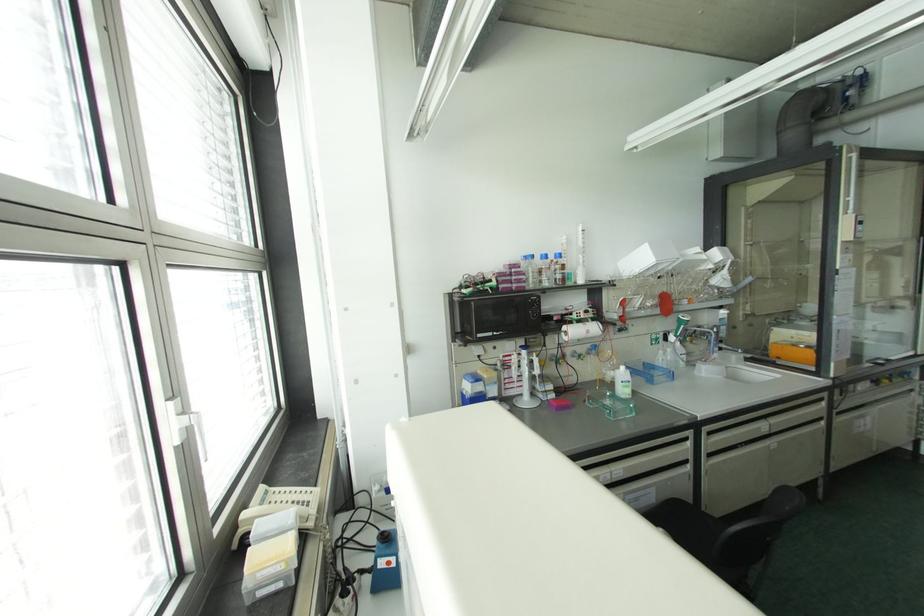
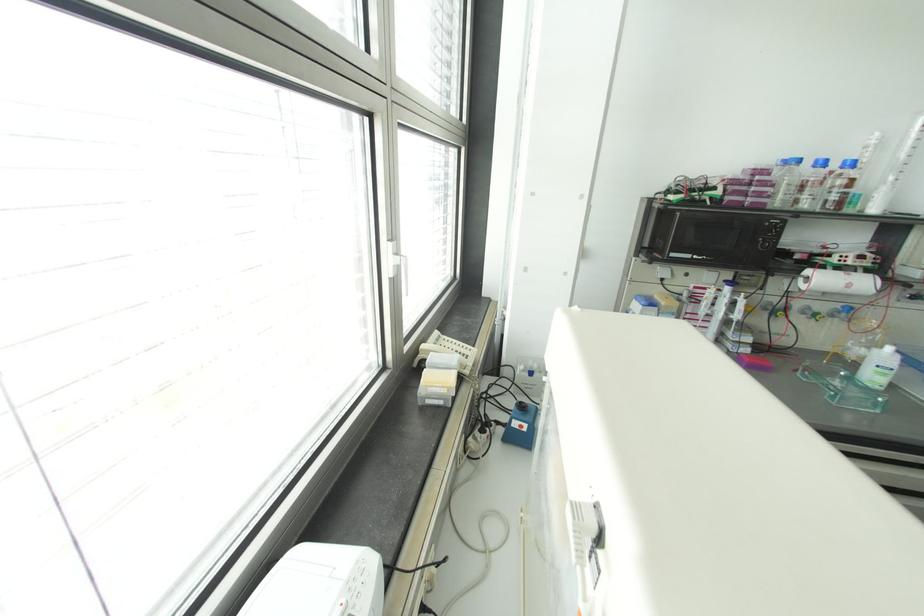
Find the pixel in the second image that matches point (298, 501) in the first image.

(459, 353)